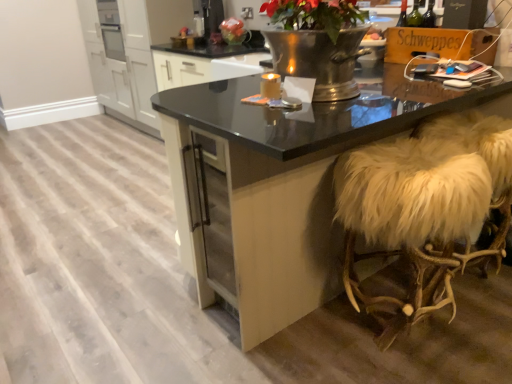
Question: Is white fur-covered stool at right taller or shorter than black glossy table at center?

Choices:
 (A) tall
 (B) short

Answer: (B)

Question: From a real-world perspective, is white fur-covered stool at right above or below black glossy table at center?

Choices:
 (A) below
 (B) above

Answer: (A)

Question: Estimate the real-world distances between objects in this image. Which object is farther from the black glossy table at center?

Choices:
 (A) white fur-covered stool at right
 (B) matte plastic bag at upper center
 (C) matte gold candle at center
 (D) white matte cabinet at left

Answer: (D)

Question: Which object is positioned farthest from the black glossy table at center?

Choices:
 (A) white fur-covered stool at right
 (B) matte gold candle at center
 (C) white matte cabinet at left
 (D) matte plastic bag at upper center

Answer: (C)